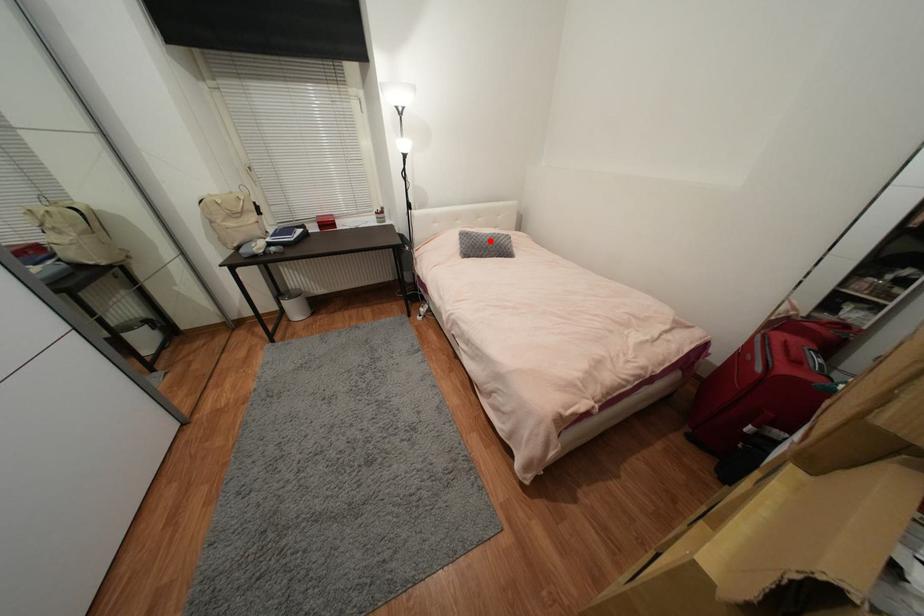
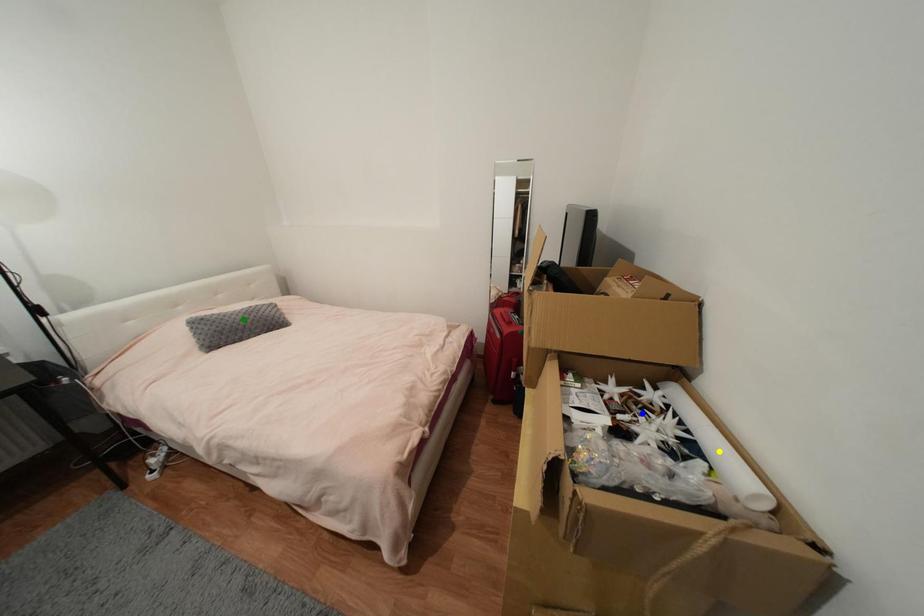
Question: I am providing you with two images of the same scene from different viewpoints. A red point is marked on the first image. You are given multiple points on the second image. In image 2, which mark is for the same physical point as the one in image 1?

Choices:
 (A) green point
 (B) yellow point
 (C) blue point

Answer: (A)